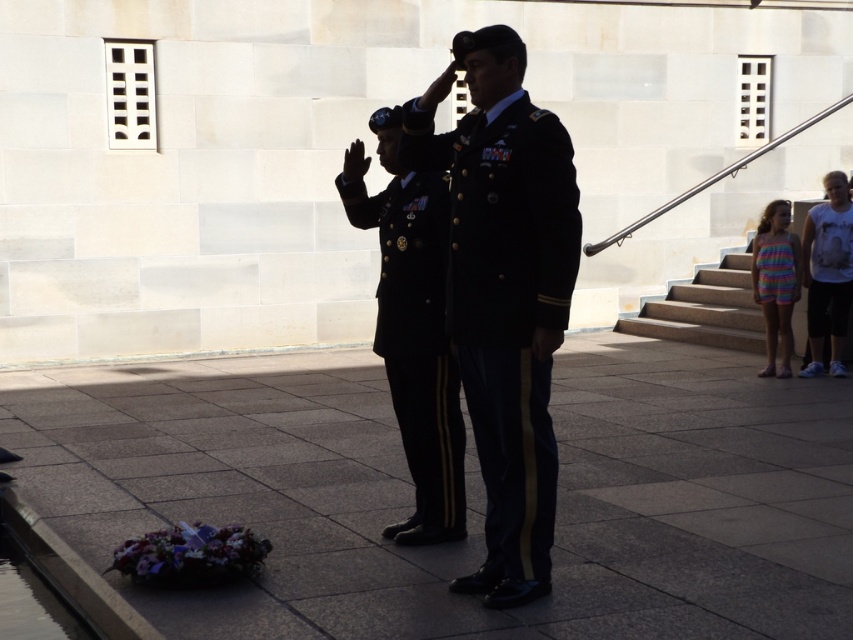
Question: Does shiny dark blue uniform at center have a larger size compared to white cotton t-shirt at right?

Choices:
 (A) no
 (B) yes

Answer: (B)

Question: Among these points, which one is nearest to the camera?

Choices:
 (A) (824, 241)
 (B) (438, 403)

Answer: (B)

Question: Can you confirm if shiny dark blue uniform at center is positioned to the left of white cotton t-shirt at right?

Choices:
 (A) no
 (B) yes

Answer: (B)

Question: Which point appears farthest from the camera in this image?

Choices:
 (A) (836, 304)
 (B) (523, 472)

Answer: (A)

Question: Does black uniform at center have a greater width compared to white cotton t-shirt at right?

Choices:
 (A) no
 (B) yes

Answer: (B)

Question: Estimate the real-world distances between objects in this image. Which object is farther from the shiny dark blue uniform at center?

Choices:
 (A) white cotton t-shirt at right
 (B) black uniform at center

Answer: (A)